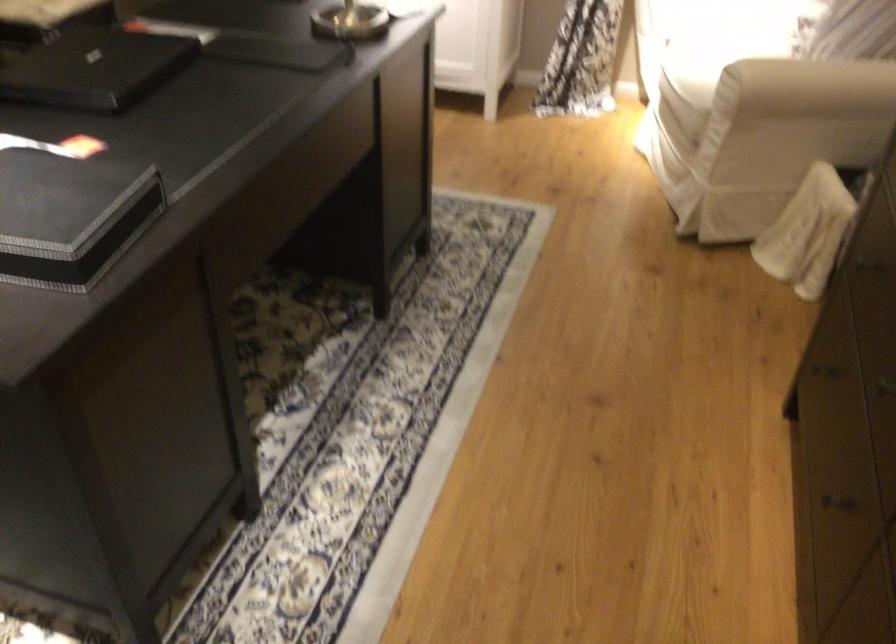
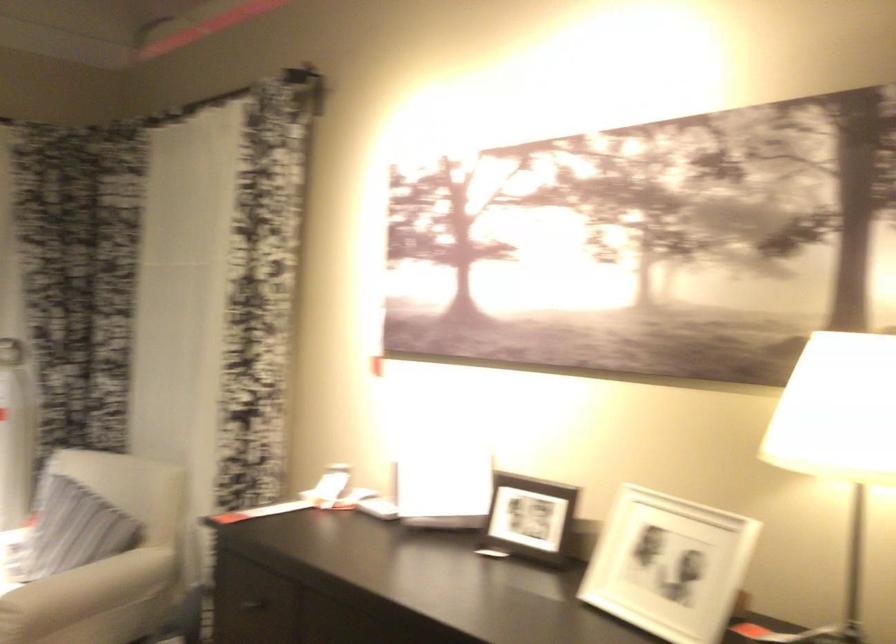
In the second image, find the point that corresponds to pixel 814 84 in the first image.

(85, 592)